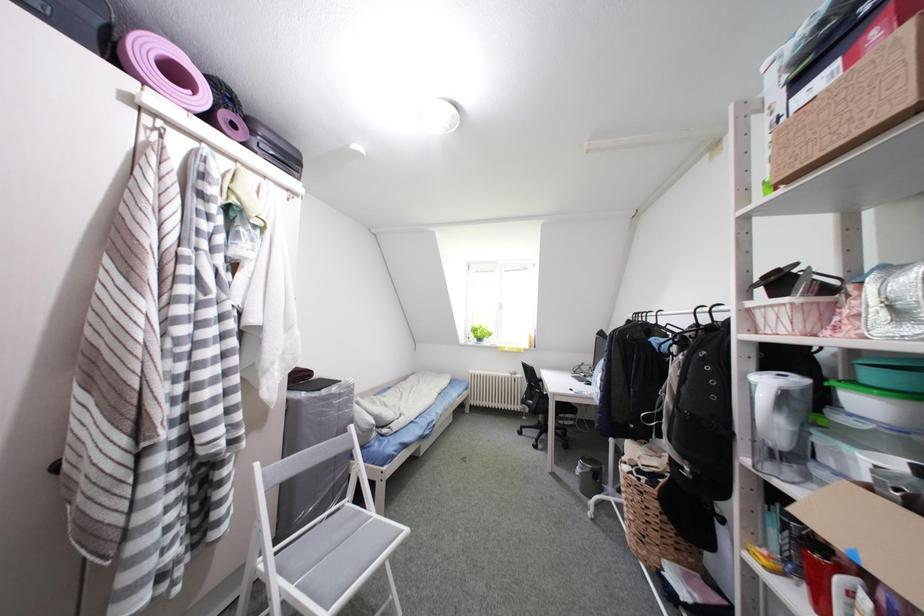
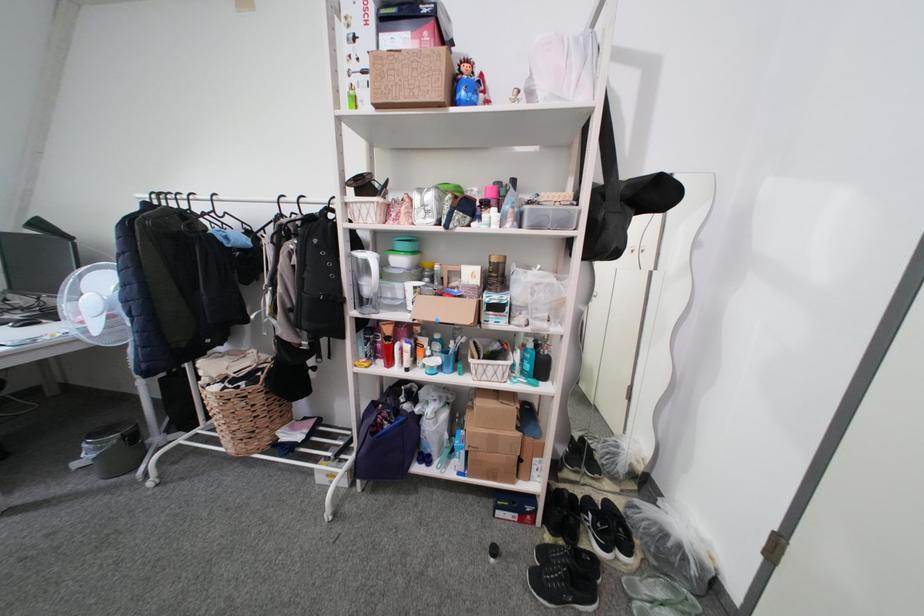
Based on the continuous images, in which direction is the camera rotating?

The rotation direction of the camera is right-down.